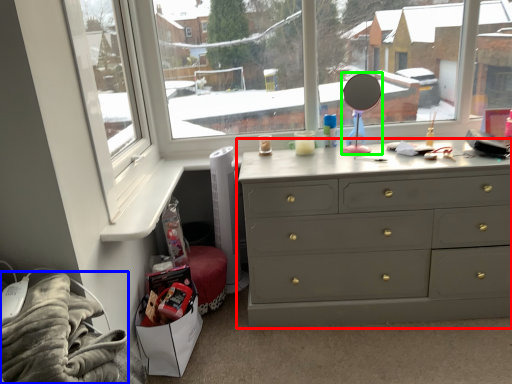
Question: Which is nearer to the chest of drawers (highlighted by a red box)? material (highlighted by a blue box) or mirror (highlighted by a green box).

Choices:
 (A) material
 (B) mirror

Answer: (B)